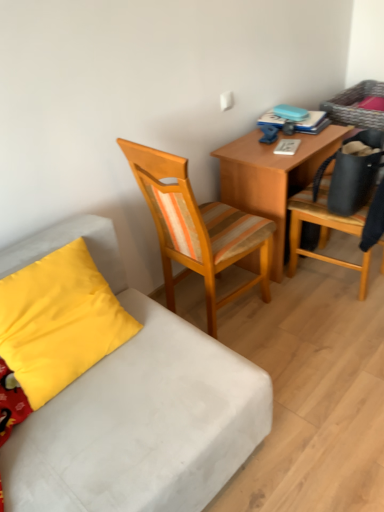
You are a GUI agent. You are given a task and a screenshot of the screen. Output one action in this format:
    pyautogui.click(x=<x>, y=<y>)
    Task: Click on the free location in front of wooden desk at center
    
    Given the screenshot: What is the action you would take?
    pyautogui.click(x=311, y=315)